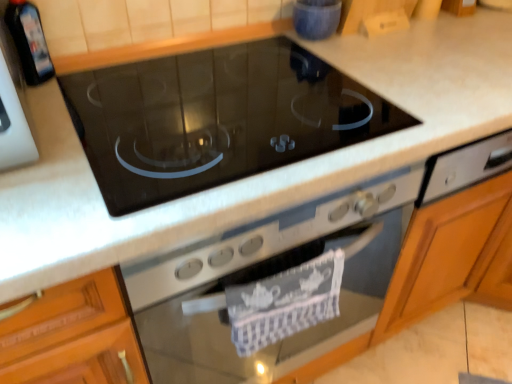
Identify the location of empty space that is to the right of blue glossy bowl at upper center, acting as the 2th appliance starting from the left. The height and width of the screenshot is (384, 512). (390, 46).